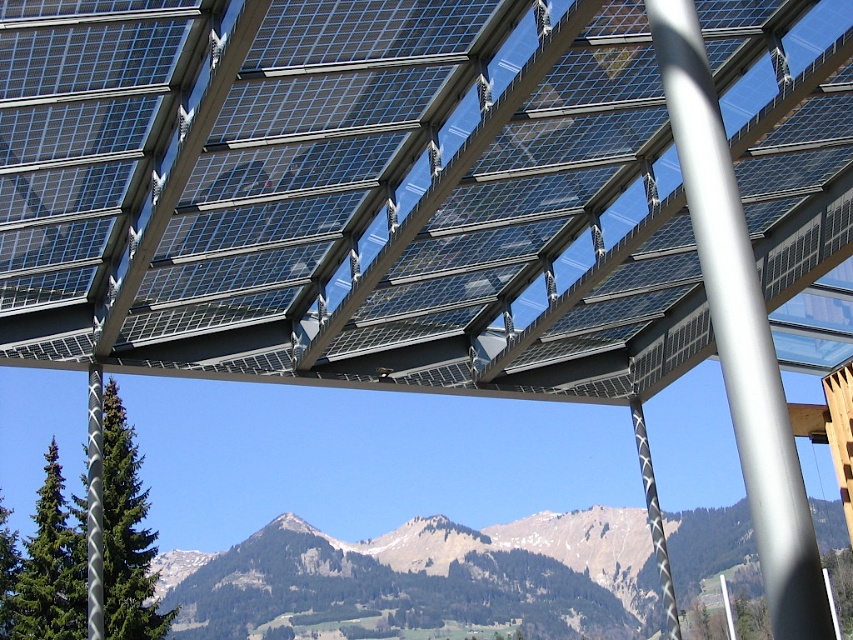
You are an engineer inspecting the solar panel structure. You notice the transparent glass solar panels at center and the rugged brown mountains at center. Which object is closer to you?

The transparent glass solar panels at center are closer to the viewer than the rugged brown mountains at center.

You are a maintenance worker needing to reach both the silver textured pole at center and the black textured pole at center. If your ladder is 15 meters long, can you safely reach both poles without moving the ladder?

The silver textured pole at center is 51.82 feet away from the black textured pole at center. Since 51.82 feet is approximately 15.8 meters, the distance between the two poles exceeds the ladder length of 15 meters. Therefore, you cannot safely reach both poles with a single ladder placement without moving it.

You are an architect designing a new ecofriendly building. You want to place a large window facing the rugged brown mountains at center so that it can also incorporate the transparent glass solar panels at center. Based on the scene, where should the window be positioned relative to the mountains?

The transparent glass solar panels at center are to the left of rugged brown mountains at center. Therefore, the window should be positioned to the left of the rugged brown mountains at center to include both the view and the solar panels.